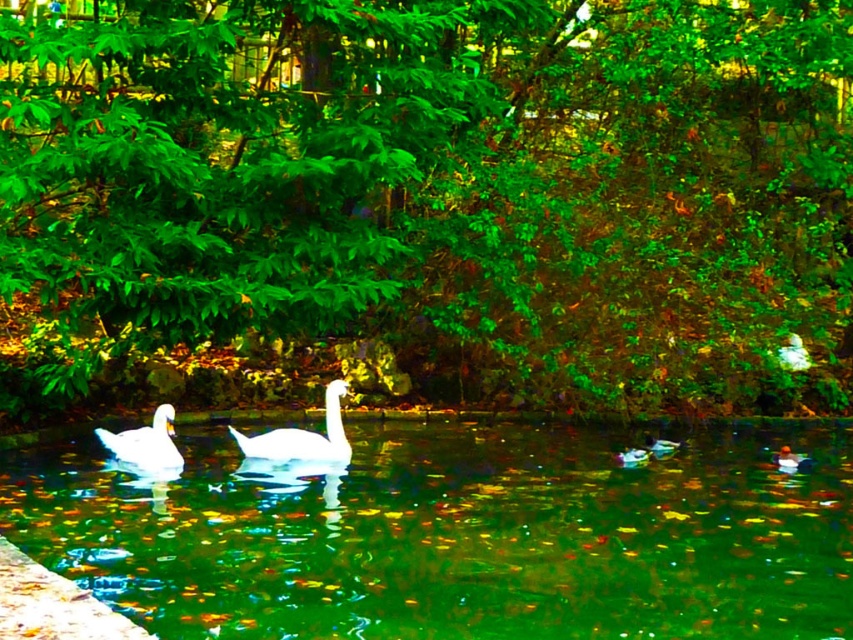
Question: Among these points, which one is nearest to the camera?

Choices:
 (A) (358, 323)
 (B) (442, 531)

Answer: (B)

Question: From the image, what is the correct spatial relationship of clear water at center in relation to white glossy swan at left?

Choices:
 (A) below
 (B) above

Answer: (A)

Question: Which of the following is the farthest from the observer?

Choices:
 (A) white glossy swan at left
 (B) clear water at center

Answer: (A)

Question: Observing the image, what is the correct spatial positioning of white glossy swan at center in reference to white glossy swan at left?

Choices:
 (A) left
 (B) right

Answer: (B)

Question: Based on their relative distances, which object is farther from the white glossy swan at center?

Choices:
 (A) white glossy swan at left
 (B) green leafy tree at center
 (C) clear water at center

Answer: (B)

Question: Can you confirm if green leafy tree at center is positioned below clear water at center?

Choices:
 (A) no
 (B) yes

Answer: (A)